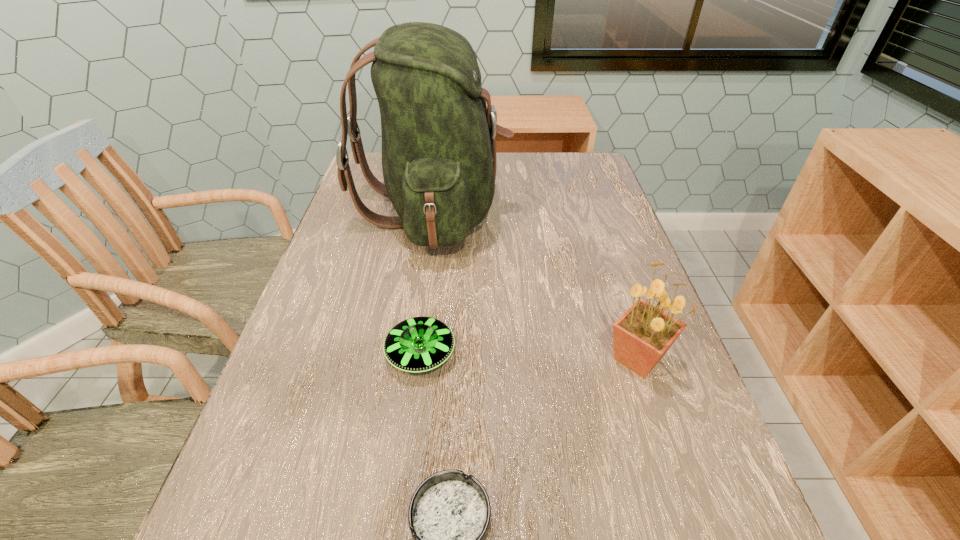
Image resolution: width=960 pixels, height=540 pixels. I want to click on object that can be found as the closest to the backpack, so click(x=418, y=344).

What are the coordinates of `free space in the image that satisfies the following two spatial constraints: 1. on the open flap of the saucer; 2. on the right side of the tallest object` in the screenshot? It's located at (414, 354).